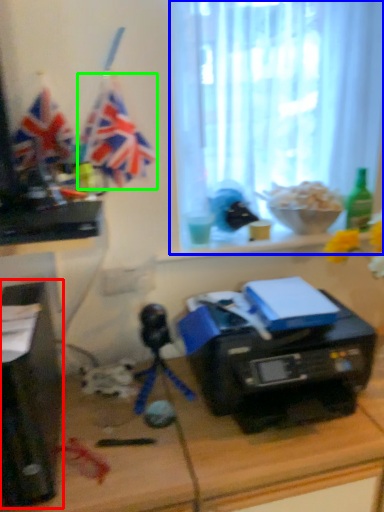
Question: Which object is the closest to the desktop computer (highlighted by a red box)? Choose among these: window screen (highlighted by a blue box) or flag (highlighted by a green box).

Choices:
 (A) window screen
 (B) flag

Answer: (B)